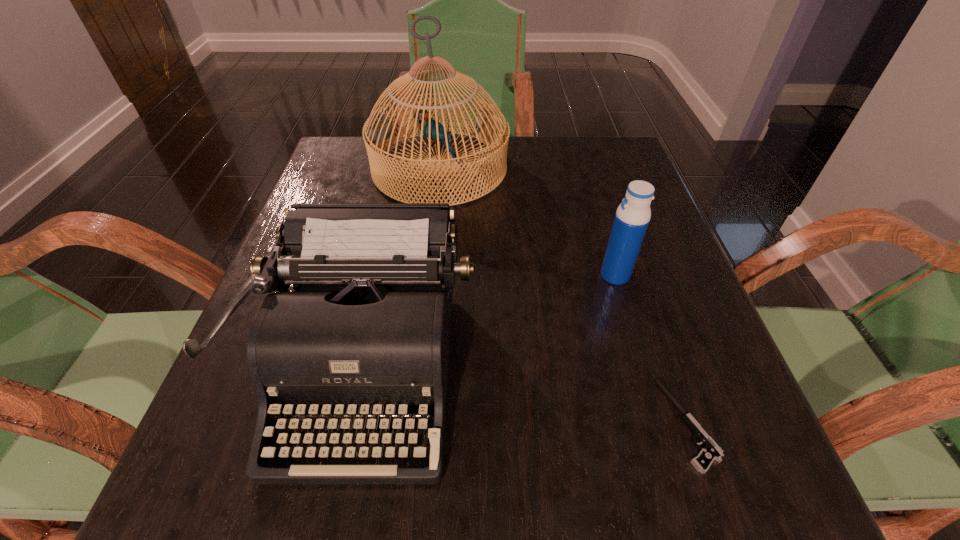
Locate an element on the screen. The width and height of the screenshot is (960, 540). the tallest object is located at coordinates (377, 128).

Locate an element on the screen. Image resolution: width=960 pixels, height=540 pixels. the farthest object is located at coordinates (377, 128).

The height and width of the screenshot is (540, 960). What are the coordinates of `water bottle` in the screenshot? It's located at (632, 217).

Where is `typewriter`? typewriter is located at coordinates (365, 331).

At what (x,y) coordinates should I click in order to perform the action: click on pistol. Please return your answer as a coordinate pair (x, y). Looking at the image, I should click on (x=711, y=451).

This screenshot has height=540, width=960. I want to click on vacant area situated 0.090m on the right of the birdcage, so click(x=545, y=168).

What are the coordinates of `vacant space located 0.290m on the back of the water bottle` in the screenshot? It's located at (587, 179).

Locate an element on the screen. blank area located 0.090m on the front-facing side of the pistol is located at coordinates (602, 424).

Find the location of `free spot located 0.230m on the front-facing side of the pistol`. free spot located 0.230m on the front-facing side of the pistol is located at coordinates (501, 424).

The image size is (960, 540). Identify the location of vacant space positioned 0.360m on the front-facing side of the pistol. (409, 424).